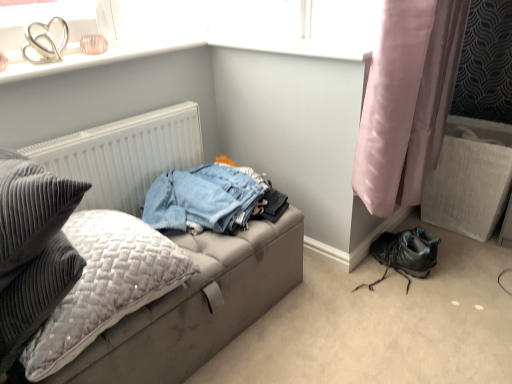
I want to click on free region under matte black shoe at lower right (from a real-world perspective), so click(x=380, y=283).